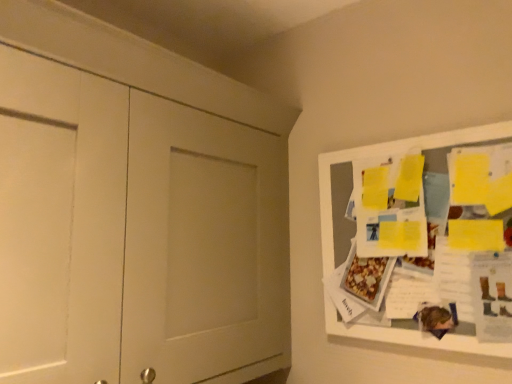
Question: Is yellow paper at upper right bigger or smaller than white matte door at left?

Choices:
 (A) big
 (B) small

Answer: (B)

Question: Is yellow paper at upper right wider or thinner than white matte door at left?

Choices:
 (A) thin
 (B) wide

Answer: (A)

Question: Is yellow paper at upper right to the left or to the right of white matte door at left in the image?

Choices:
 (A) left
 (B) right

Answer: (B)

Question: From the image's perspective, relative to yellow paper at upper right, is white matte door at left above or below?

Choices:
 (A) below
 (B) above

Answer: (B)

Question: In the image, is white matte door at left positioned in front of or behind yellow paper at upper right?

Choices:
 (A) behind
 (B) front

Answer: (B)

Question: In terms of height, does white matte door at left look taller or shorter compared to yellow paper at upper right?

Choices:
 (A) short
 (B) tall

Answer: (B)

Question: Looking at the image, does white matte door at left seem bigger or smaller compared to yellow paper at upper right?

Choices:
 (A) big
 (B) small

Answer: (A)